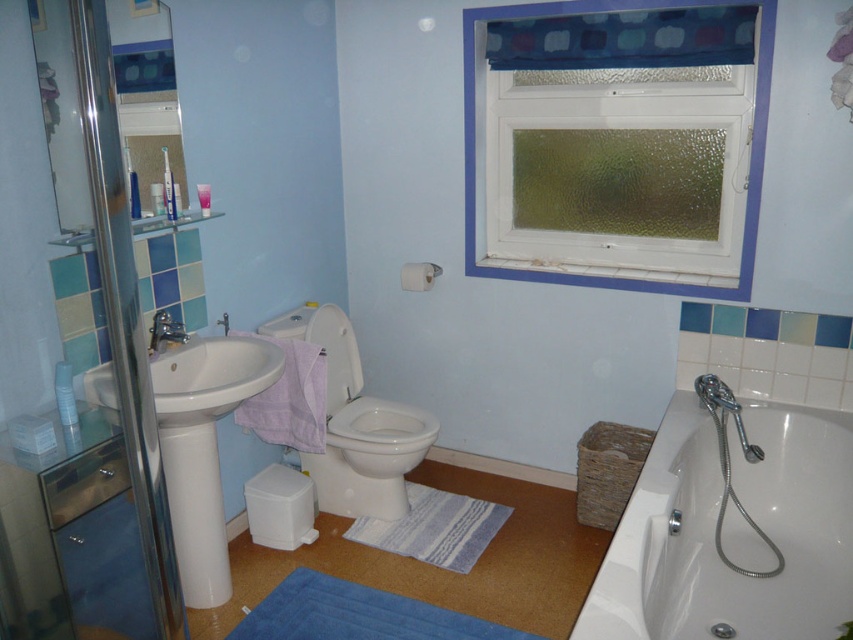
Which is below, transparent glass shower door at left or white glossy bathtub at lower right?

white glossy bathtub at lower right is below.

Who is more distant from viewer, (67, 433) or (706, 490)?

The point (706, 490) is behind.

Who is more forward, (136, 342) or (795, 634)?

Point (136, 342) is more forward.

This screenshot has height=640, width=853. I want to click on transparent glass shower door at left, so click(64, 355).

Is the position of white glossy toilet bowl at center more distant than that of blue striped bath mat at center?

Yes, white glossy toilet bowl at center is further from the viewer.

Does white glossy toilet bowl at center have a larger size compared to blue striped bath mat at center?

Indeed, white glossy toilet bowl at center has a larger size compared to blue striped bath mat at center.

In order to click on white glossy toilet bowl at center in this screenshot , I will do `click(355, 424)`.

Locate an element on the screen. This screenshot has width=853, height=640. white glossy toilet bowl at center is located at coordinates (355, 424).

Is white glossy toilet bowl at center shorter than blue plush bath mat at lower center?

Incorrect, white glossy toilet bowl at center's height does not fall short of blue plush bath mat at lower center's.

From the picture: Is the position of white glossy toilet bowl at center more distant than that of blue plush bath mat at lower center?

Yes, it is.

Which is in front, point (397, 451) or point (337, 627)?

Point (337, 627) is in front.

This screenshot has height=640, width=853. I want to click on white glossy toilet bowl at center, so click(x=355, y=424).